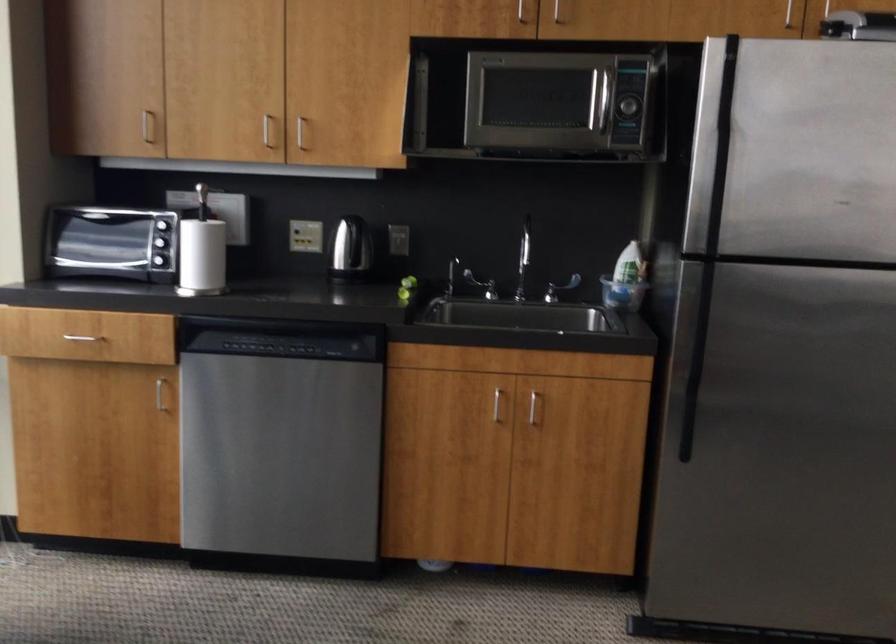
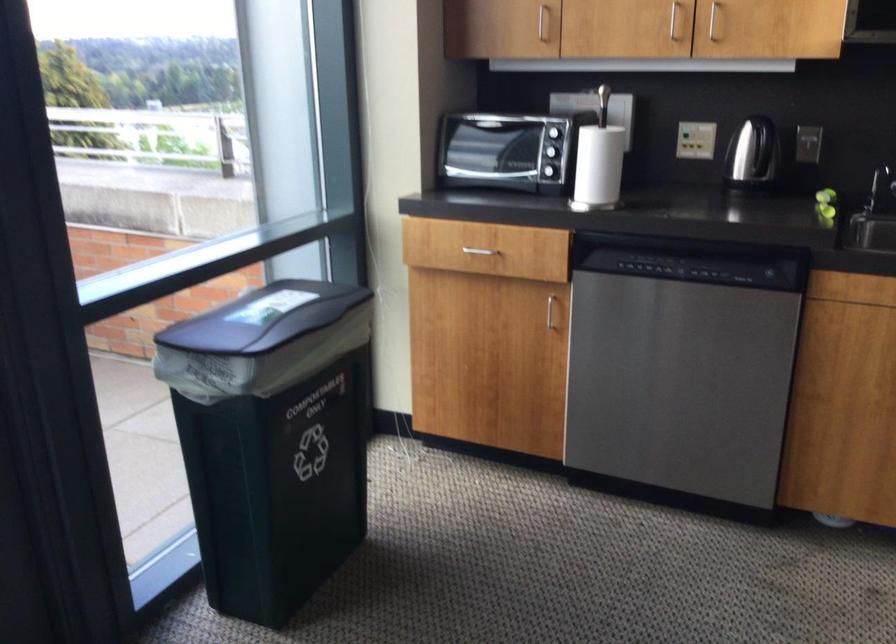
Where in the second image is the point corresponding to the point at 277,131 from the first image?

(673, 20)